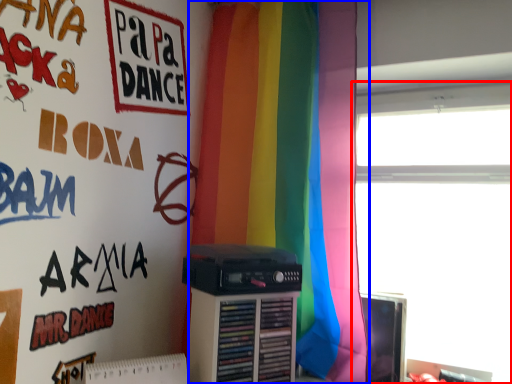
Question: Which of the following is the closest to the observer, window (highlighted by a red box) or curtain (highlighted by a blue box)?

Choices:
 (A) window
 (B) curtain

Answer: (B)